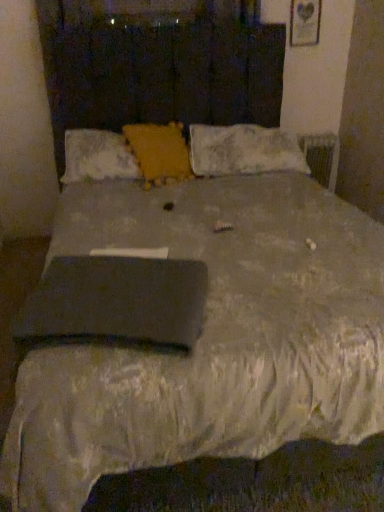
Question: Is white fluffy pillow at upper right, acting as the 1th pillow starting from the right, smaller than yellow textured pillow at center, which appears as the second pillow when viewed from the right?

Choices:
 (A) yes
 (B) no

Answer: (B)

Question: Is white fluffy pillow at upper right, acting as the 1th pillow starting from the right, wider than yellow textured pillow at center, which is the second pillow from left to right?

Choices:
 (A) yes
 (B) no

Answer: (A)

Question: Is the depth of white fluffy pillow at upper right, arranged as the third pillow when viewed from the left, greater than that of yellow textured pillow at center, which appears as the second pillow when viewed from the right?

Choices:
 (A) no
 (B) yes

Answer: (B)

Question: From the image's perspective, is white fluffy pillow at upper right, acting as the 1th pillow starting from the right, below yellow textured pillow at center, which appears as the second pillow when viewed from the right?

Choices:
 (A) yes
 (B) no

Answer: (B)

Question: Can you confirm if white fluffy pillow at upper right, arranged as the third pillow when viewed from the left, is shorter than yellow textured pillow at center, which appears as the second pillow when viewed from the right?

Choices:
 (A) yes
 (B) no

Answer: (A)

Question: Considering the positions of yellow textured pillow at center, which is the second pillow from left to right, and black matte pad at center in the image, is yellow textured pillow at center, which is the second pillow from left to right, taller or shorter than black matte pad at center?

Choices:
 (A) tall
 (B) short

Answer: (A)

Question: Considering the relative positions of yellow textured pillow at center, which appears as the second pillow when viewed from the right, and black matte pad at center in the image provided, is yellow textured pillow at center, which appears as the second pillow when viewed from the right, to the left or to the right of black matte pad at center?

Choices:
 (A) left
 (B) right

Answer: (B)

Question: Relative to black matte pad at center, is yellow textured pillow at center, which is the second pillow from left to right, in front or behind?

Choices:
 (A) front
 (B) behind

Answer: (B)

Question: Would you say yellow textured pillow at center, which appears as the second pillow when viewed from the right, is inside or outside black matte pad at center?

Choices:
 (A) outside
 (B) inside

Answer: (A)

Question: Considering the positions of white fluffy pillow at upper right, acting as the 1th pillow starting from the right, and yellow textured pillow at center, which appears as the second pillow when viewed from the right, in the image, is white fluffy pillow at upper right, acting as the 1th pillow starting from the right, bigger or smaller than yellow textured pillow at center, which appears as the second pillow when viewed from the right,?

Choices:
 (A) small
 (B) big

Answer: (B)

Question: In the image, is white fluffy pillow at upper right, arranged as the third pillow when viewed from the left, positioned in front of or behind yellow textured pillow at center, which is the second pillow from left to right?

Choices:
 (A) behind
 (B) front

Answer: (A)

Question: In the image, is white fluffy pillow at upper right, acting as the 1th pillow starting from the right, on the left side or the right side of yellow textured pillow at center, which is the second pillow from left to right?

Choices:
 (A) right
 (B) left

Answer: (A)

Question: Is white fluffy pillow at upper right, acting as the 1th pillow starting from the right, inside or outside of yellow textured pillow at center, which appears as the second pillow when viewed from the right?

Choices:
 (A) inside
 (B) outside

Answer: (B)

Question: Based on their positions, is yellow textured pillow at center, which is the second pillow from left to right, located to the left or right of white fluffy pillow at upper right, arranged as the third pillow when viewed from the left?

Choices:
 (A) left
 (B) right

Answer: (A)

Question: In terms of width, does yellow textured pillow at center, which is the second pillow from left to right, look wider or thinner when compared to white fluffy pillow at upper right, arranged as the third pillow when viewed from the left?

Choices:
 (A) thin
 (B) wide

Answer: (A)